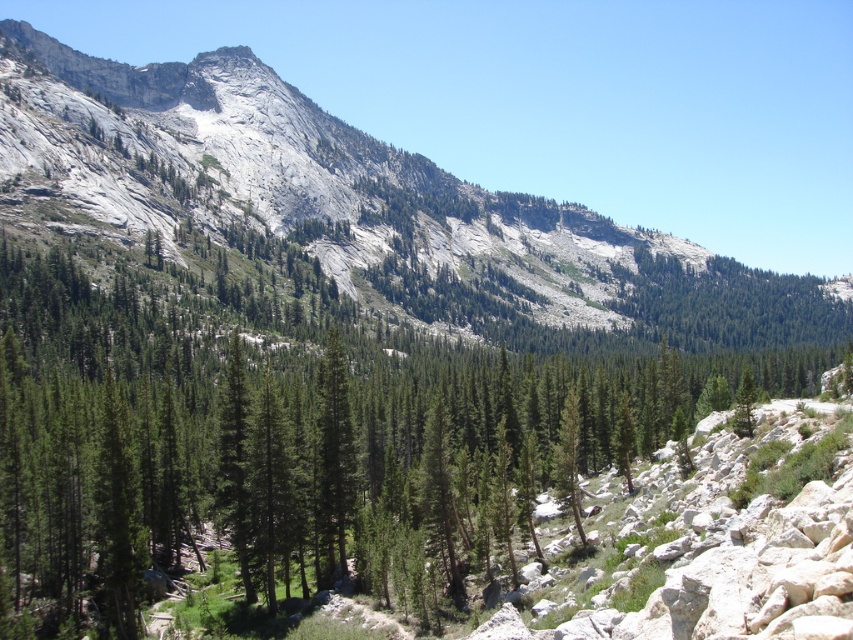
Question: Which point appears farthest from the camera in this image?

Choices:
 (A) (108, 609)
 (B) (581, 308)

Answer: (B)

Question: Which of the following is the farthest from the observer?

Choices:
 (A) (352, 211)
 (B) (564, 477)

Answer: (A)

Question: Does green matte tree at center appear under gray rock mountain at center?

Choices:
 (A) yes
 (B) no

Answer: (A)

Question: Does green matte tree at center appear on the right side of gray rock mountain at center?

Choices:
 (A) no
 (B) yes

Answer: (A)

Question: Is green matte tree at center above gray rock mountain at center?

Choices:
 (A) no
 (B) yes

Answer: (A)

Question: Which object appears closest to the camera in this image?

Choices:
 (A) green matte tree at center
 (B) gray rock mountain at center

Answer: (A)